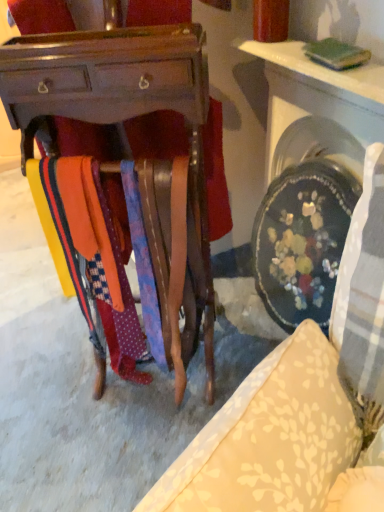
Where is `vacant point to the right of polka dot fabric tie at center`? The image size is (384, 512). vacant point to the right of polka dot fabric tie at center is located at coordinates (220, 365).